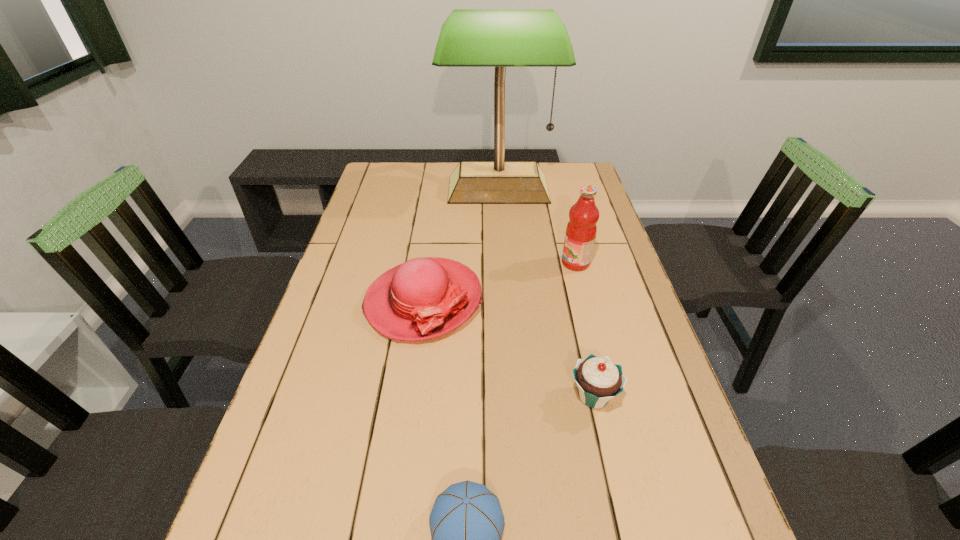
Identify the location of free space between the table lamp and the cupcake. This screenshot has width=960, height=540. (546, 293).

The image size is (960, 540). Find the location of `free spot between the tallest object and the fourth shortest object`. free spot between the tallest object and the fourth shortest object is located at coordinates (537, 226).

Find the location of a particular element. The image size is (960, 540). unoccupied area between the cupcake and the table lamp is located at coordinates (546, 293).

You are a GUI agent. You are given a task and a screenshot of the screen. Output one action in this format:
    pyautogui.click(x=<x>, y=<y>)
    Task: Click on the empty location between the table lamp and the fruit juice
    The width and height of the screenshot is (960, 540).
    Given the screenshot: What is the action you would take?
    (x=537, y=226)

Where is `vacant area that lies between the fruit juice and the tallest object`? The width and height of the screenshot is (960, 540). vacant area that lies between the fruit juice and the tallest object is located at coordinates (537, 226).

Find the location of a particular element. The height and width of the screenshot is (540, 960). free space that is in between the hat and the fruit juice is located at coordinates click(x=499, y=282).

Identify the location of vacant space that is in between the fourth shortest object and the cupcake. (585, 329).

I want to click on vacant area that lies between the farthest object and the fourth shortest object, so click(537, 226).

Identify which object is the third closest to the nearest object. Please provide its 2D coordinates. Your answer should be formatted as a tuple, i.e. [(x, y)], where the tuple contains the x and y coordinates of a point satisfying the conditions above.

[(581, 230)]

At what (x,y) coordinates should I click in order to perform the action: click on the fourth closest object relative to the fourth shortest object. Please return your answer as a coordinate pair (x, y). The width and height of the screenshot is (960, 540). Looking at the image, I should click on [466, 523].